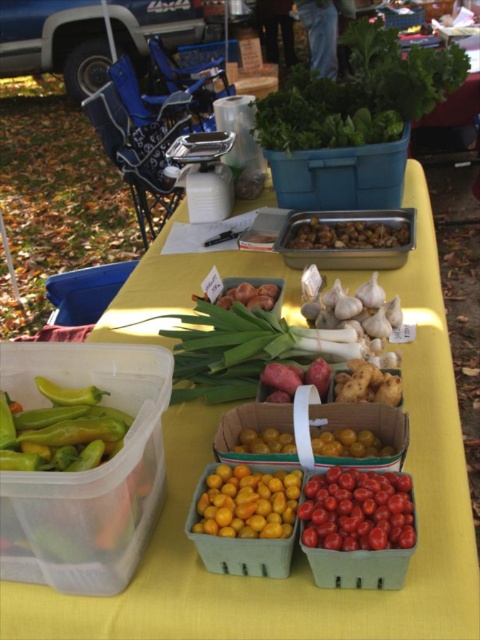
You are setting up a display at the farmer market and want to arrange items so that the taller item is placed behind the shorter one to ensure visibility. Given the items brown matte nuts at center and yellow matte cherry tomatoes at center, which one should you place in the back?

The brown matte nuts at center is taller than the yellow matte cherry tomatoes at center, so you should place the brown matte nuts at center in the back to ensure visibility.